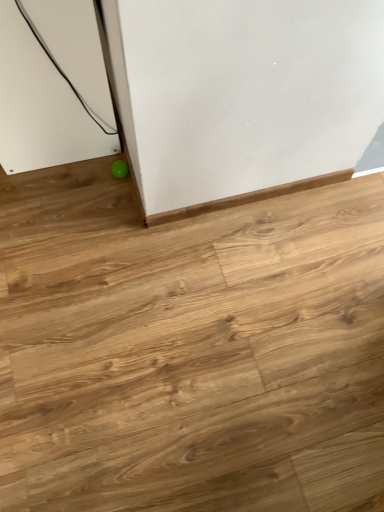
What are the coordinates of `light brown wood floor at lower left` in the screenshot? It's located at (190, 349).

Describe the element at coordinates (190, 349) in the screenshot. Image resolution: width=384 pixels, height=512 pixels. I see `light brown wood floor at lower left` at that location.

The height and width of the screenshot is (512, 384). Identify the location of green rubber ball at lower left. (120, 169).

What is the approximate height of green rubber ball at lower left?

It is 1.64 inches.

Image resolution: width=384 pixels, height=512 pixels. What do you see at coordinates (120, 169) in the screenshot? I see `green rubber ball at lower left` at bounding box center [120, 169].

Where is `light brown wood floor at lower left`? The image size is (384, 512). light brown wood floor at lower left is located at coordinates (190, 349).

Based on their positions, is light brown wood floor at lower left located to the left or right of green rubber ball at lower left?

light brown wood floor at lower left is to the right of green rubber ball at lower left.

Is the position of light brown wood floor at lower left less distant than that of green rubber ball at lower left?

Yes, light brown wood floor at lower left is closer to the viewer.

Does point (36, 479) come closer to viewer compared to point (120, 166)?

Yes, point (36, 479) is in front of point (120, 166).

From the image's perspective, would you say light brown wood floor at lower left is shown under green rubber ball at lower left?

Indeed, from the image's perspective, light brown wood floor at lower left is shown beneath green rubber ball at lower left.

From a real-world perspective, which object stands above the other?

green rubber ball at lower left.

Is light brown wood floor at lower left thinner than green rubber ball at lower left?

In fact, light brown wood floor at lower left might be wider than green rubber ball at lower left.

Considering the sizes of light brown wood floor at lower left and green rubber ball at lower left in the image, is light brown wood floor at lower left taller or shorter than green rubber ball at lower left?

light brown wood floor at lower left is taller than green rubber ball at lower left.

In the scene shown: Based on their sizes in the image, would you say light brown wood floor at lower left is bigger or smaller than green rubber ball at lower left?

Considering their sizes, light brown wood floor at lower left takes up more space than green rubber ball at lower left.

Is light brown wood floor at lower left situated inside green rubber ball at lower left or outside?

light brown wood floor at lower left is outside green rubber ball at lower left.

Is light brown wood floor at lower left with green rubber ball at lower left?

No, light brown wood floor at lower left is not making contact with green rubber ball at lower left.

Is green rubber ball at lower left at the back of light brown wood floor at lower left?

Absolutely, light brown wood floor at lower left is directed away from green rubber ball at lower left.

I want to click on plywood below the green rubber ball at lower left (from the image's perspective), so click(190, 349).

Considering the relative positions of green rubber ball at lower left and light brown wood floor at lower left in the image provided, is green rubber ball at lower left to the right of light brown wood floor at lower left from the viewer's perspective?

No, green rubber ball at lower left is not to the right of light brown wood floor at lower left.

Considering their positions, is green rubber ball at lower left located in front of or behind light brown wood floor at lower left?

Visually, green rubber ball at lower left is located behind light brown wood floor at lower left.

Is point (120, 160) behind point (338, 475)?

Yes, point (120, 160) is farther from viewer.

From the image's perspective, is green rubber ball at lower left located above or below light brown wood floor at lower left?

Clearly, from the image's perspective, green rubber ball at lower left is above light brown wood floor at lower left.

From a real-world perspective, which object stands above the other?

green rubber ball at lower left is physically above.

Is green rubber ball at lower left wider or thinner than light brown wood floor at lower left?

green rubber ball at lower left is thinner than light brown wood floor at lower left.

Considering the sizes of objects green rubber ball at lower left and light brown wood floor at lower left in the image provided, who is taller, green rubber ball at lower left or light brown wood floor at lower left?

With more height is light brown wood floor at lower left.

Is green rubber ball at lower left smaller than light brown wood floor at lower left?

Yes, green rubber ball at lower left is smaller than light brown wood floor at lower left.

Which is correct: green rubber ball at lower left is inside light brown wood floor at lower left, or outside of it?

green rubber ball at lower left is located inside light brown wood floor at lower left.

Is green rubber ball at lower left in contact with light brown wood floor at lower left?

No, green rubber ball at lower left is not next to light brown wood floor at lower left.

Is green rubber ball at lower left facing away from light brown wood floor at lower left?

Yes, green rubber ball at lower left is facing away from light brown wood floor at lower left.

How many degrees apart are the facing directions of green rubber ball at lower left and light brown wood floor at lower left?

green rubber ball at lower left and light brown wood floor at lower left are facing 91 degrees away from each other.

How far apart are green rubber ball at lower left and light brown wood floor at lower left?

green rubber ball at lower left and light brown wood floor at lower left are 26.63 inches apart from each other.

In the image, there is a green rubber ball at lower left. Where is `plywood below it (from a real-world perspective)`? plywood below it (from a real-world perspective) is located at coordinates (190, 349).

At what (x,y) coordinates should I click in order to perform the action: click on ball behind the light brown wood floor at lower left. Please return your answer as a coordinate pair (x, y). Looking at the image, I should click on (120, 169).

There is a light brown wood floor at lower left. Find the location of `ball above it (from a real-world perspective)`. ball above it (from a real-world perspective) is located at coordinates (120, 169).